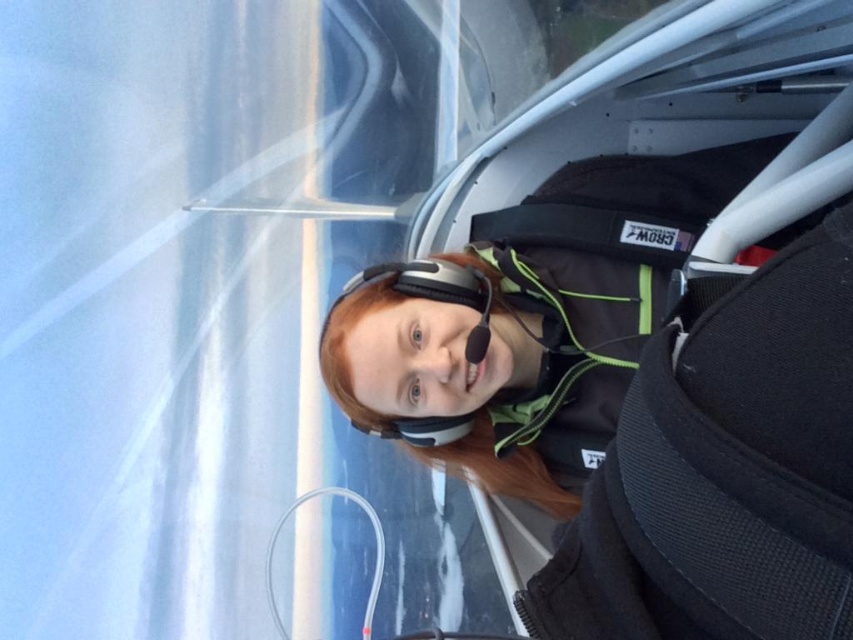
You are a pilot preparing for a flight and notice both the black fabric strap at center and the transparent plastic goggles at center in your cockpit. Which item is positioned higher when looking straight ahead?

The black fabric strap at center is located above the transparent plastic goggles at center, so it is positioned higher when looking straight ahead.

You are a photographer standing in front of the cockpit of the small aircraft. You want to take a photo of the black fabric strap at center without any obstructions. Given that your camera has a focal length of 50mm and you are currently 2 meters away from the strap, should you move closer or farther away to avoid the wing obstructing the view?

The black fabric strap at center is 1.52 meters from camera. Since you are currently 2 meters away, which is farther than the required 1.52 meters, you should move closer to the strap to ensure it is within the optimal focus range and avoid obstruction by the wing.

You are a drone operator trying to navigate between two points in the cockpit of a small aircraft. The first point is point (543, 428) and the second point is point (467, 292). Which point is located further back in the cockpit?

Point (543, 428) is behind point (467, 292), so it is located further back in the cockpit.